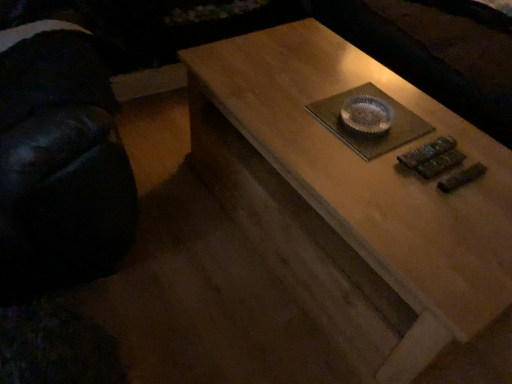
Question: Does wooden coffee table at center have a lesser width compared to black fabric swivel chair at left?

Choices:
 (A) yes
 (B) no

Answer: (B)

Question: From a real-world perspective, is wooden coffee table at center physically below black fabric swivel chair at left?

Choices:
 (A) yes
 (B) no

Answer: (A)

Question: Is wooden coffee table at center placed right next to black fabric swivel chair at left?

Choices:
 (A) yes
 (B) no

Answer: (B)

Question: Would you say wooden coffee table at center is outside black fabric swivel chair at left?

Choices:
 (A) yes
 (B) no

Answer: (A)

Question: Does wooden coffee table at center have a greater width compared to black fabric swivel chair at left?

Choices:
 (A) no
 (B) yes

Answer: (B)

Question: Is wooden coffee table at center closer to the viewer compared to black fabric swivel chair at left?

Choices:
 (A) yes
 (B) no

Answer: (B)

Question: Is black fabric swivel chair at left thinner than wooden coffee table at center?

Choices:
 (A) yes
 (B) no

Answer: (A)

Question: Is black fabric swivel chair at left facing away from wooden coffee table at center?

Choices:
 (A) no
 (B) yes

Answer: (A)

Question: Is the position of black fabric swivel chair at left more distant than that of wooden coffee table at center?

Choices:
 (A) no
 (B) yes

Answer: (A)

Question: Is black fabric swivel chair at left at the right side of wooden coffee table at center?

Choices:
 (A) no
 (B) yes

Answer: (A)

Question: Can you confirm if black fabric swivel chair at left is wider than wooden coffee table at center?

Choices:
 (A) no
 (B) yes

Answer: (A)

Question: Does black fabric swivel chair at left have a larger size compared to wooden coffee table at center?

Choices:
 (A) yes
 (B) no

Answer: (A)

Question: Looking at the image, does wooden coffee table at center seem bigger or smaller compared to black fabric swivel chair at left?

Choices:
 (A) small
 (B) big

Answer: (A)